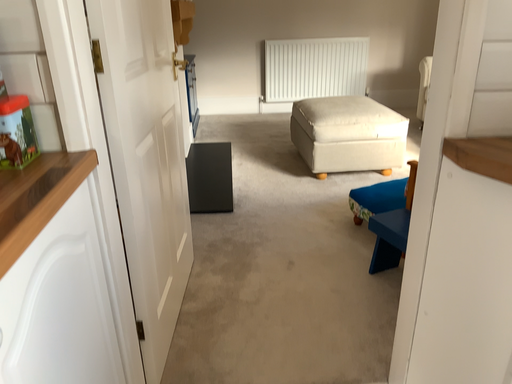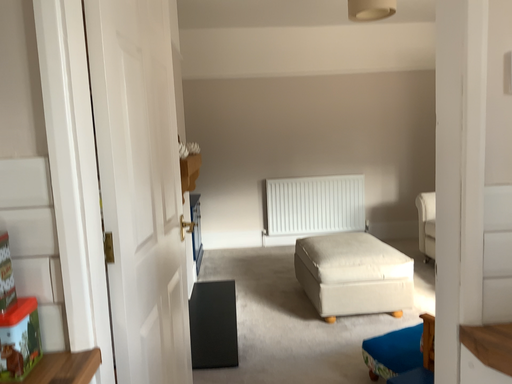
Question: How did the camera likely rotate when shooting the video?

Choices:
 (A) rotated downward
 (B) rotated upward

Answer: (B)